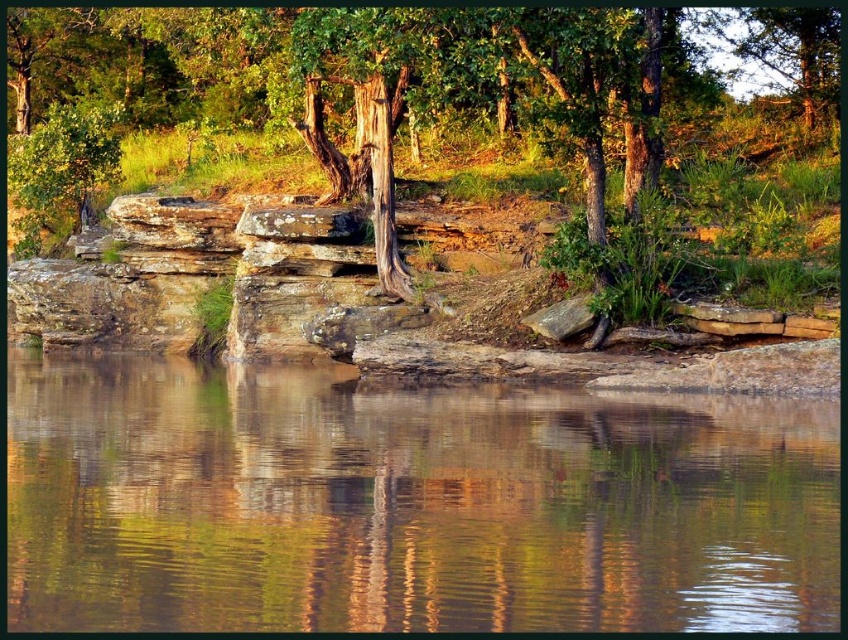
Consider the image. Can you confirm if green reflective water at center is smaller than smooth bark tree at center?

Indeed, green reflective water at center has a smaller size compared to smooth bark tree at center.

Is green reflective water at center to the left of smooth bark tree at center from the viewer's perspective?

No, green reflective water at center is not to the left of smooth bark tree at center.

Which is in front, point (607, 616) or point (551, 113)?

Positioned in front is point (607, 616).

At what (x,y) coordinates should I click in order to perform the action: click on green reflective water at center. Please return your answer as a coordinate pair (x, y). The width and height of the screenshot is (848, 640). Looking at the image, I should click on (408, 502).